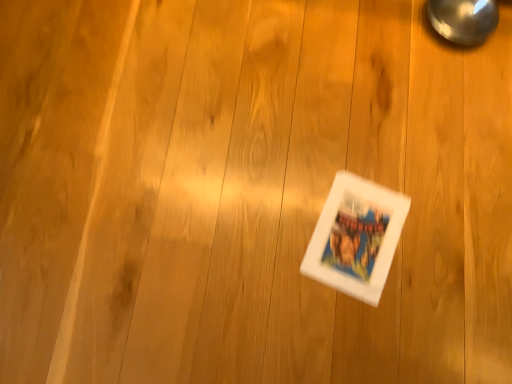
The height and width of the screenshot is (384, 512). In order to click on free space above polished metallic magnifying glass at upper right (from a real-world perspective) in this screenshot , I will do `click(465, 8)`.